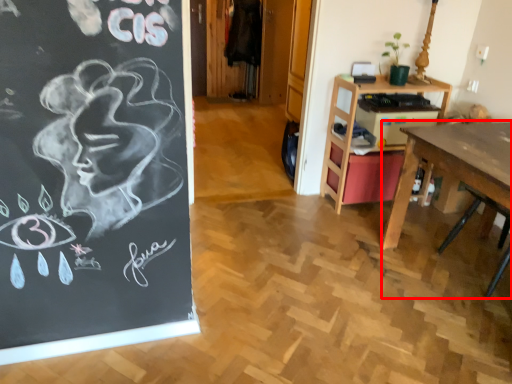
Question: Considering the relative positions of desk (annotated by the red box) and table in the image provided, where is desk (annotated by the red box) located with respect to the staircase?

Choices:
 (A) left
 (B) right

Answer: (B)